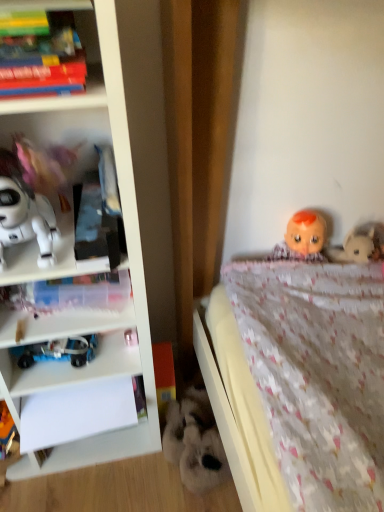
Question: Is white matte robot at left, the third toy in the bottom-to-top sequence, outside of blue plastic toy at lower left, marked as the 2th toy in a left-to-right arrangement?

Choices:
 (A) no
 (B) yes

Answer: (B)

Question: From the image's perspective, does white matte robot at left, the third toy in the bottom-to-top sequence, appear higher than blue plastic toy at lower left, which is the 2th toy from bottom to top?

Choices:
 (A) no
 (B) yes

Answer: (B)

Question: Is the position of white matte robot at left, arranged as the 4th toy when viewed from the right, more distant than that of blue plastic toy at lower left, the 3th toy when ordered from top to bottom?

Choices:
 (A) no
 (B) yes

Answer: (A)

Question: Is white matte robot at left, the third toy in the bottom-to-top sequence, beside blue plastic toy at lower left, which is the 2th toy from bottom to top?

Choices:
 (A) no
 (B) yes

Answer: (A)

Question: From a real-world perspective, is matte plastic books at upper left positioned above or below white matte robot at left, the third toy in the bottom-to-top sequence?

Choices:
 (A) above
 (B) below

Answer: (A)

Question: Is point (57, 0) closer or farther from the camera than point (18, 219)?

Choices:
 (A) farther
 (B) closer

Answer: (B)

Question: Looking at their shapes, would you say matte plastic books at upper left is wider or thinner than white matte robot at left, the 2th toy in the top-to-bottom sequence?

Choices:
 (A) thin
 (B) wide

Answer: (A)

Question: Visually, is matte plastic books at upper left positioned to the left or to the right of white matte robot at left, the 2th toy in the top-to-bottom sequence?

Choices:
 (A) right
 (B) left

Answer: (A)

Question: Is point click(x=105, y=281) positioned closer to the camera than point click(x=19, y=141)?

Choices:
 (A) closer
 (B) farther

Answer: (B)

Question: In the image, is transparent plastic book at left positioned in front of or behind pink fabric doll at left, which is the 3th toy from left to right?

Choices:
 (A) front
 (B) behind

Answer: (B)

Question: Is transparent plastic book at left taller or shorter than pink fabric doll at left, the second toy when ordered from right to left?

Choices:
 (A) short
 (B) tall

Answer: (A)

Question: From a real-world perspective, is transparent plastic book at left above or below pink fabric doll at left, arranged as the fourth toy when ordered from the bottom?

Choices:
 (A) above
 (B) below

Answer: (B)

Question: Is blue plastic toy at lower left, marked as the 2th toy in a left-to-right arrangement, wider or thinner than matte plastic books at upper left?

Choices:
 (A) wide
 (B) thin

Answer: (B)

Question: Relative to matte plastic books at upper left, is blue plastic toy at lower left, the 3th toy when ordered from top to bottom, in front or behind?

Choices:
 (A) behind
 (B) front

Answer: (A)